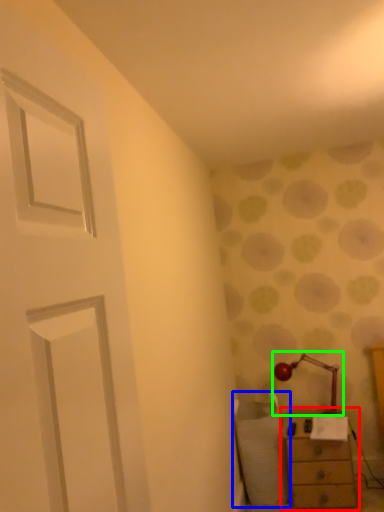
Question: Which is nearer to the chest of drawers (highlighted by a red box)? swivel chair (highlighted by a blue box) or table lamp (highlighted by a green box).

Choices:
 (A) swivel chair
 (B) table lamp

Answer: (A)